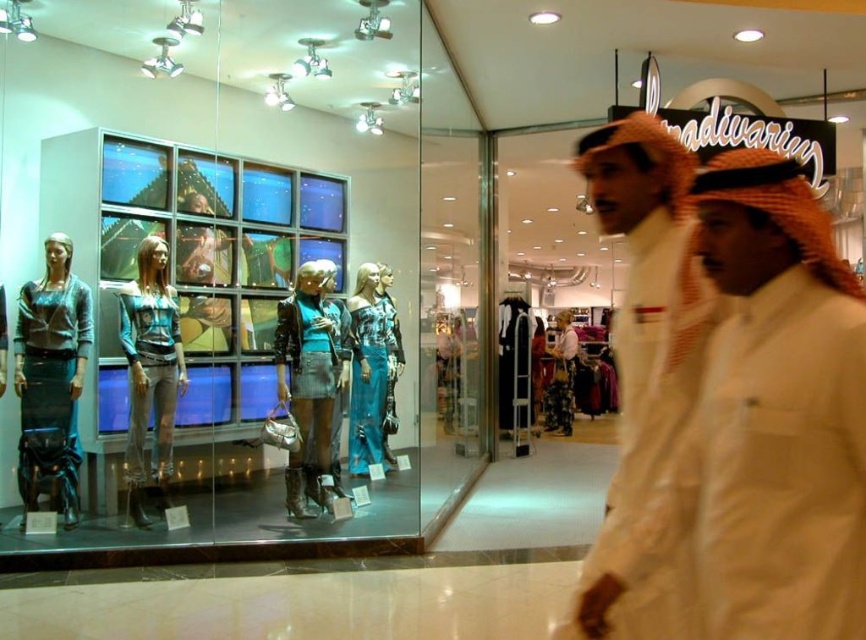
Question: Which object is positioned closest to the floral fabric dress at center?

Choices:
 (A) matte teal fabric dress at center
 (B) white cotton headscarf at center

Answer: (A)

Question: Is white cotton headscarf at center to the left of floral fabric dress at center from the viewer's perspective?

Choices:
 (A) yes
 (B) no

Answer: (A)

Question: Which object appears closest to the camera in this image?

Choices:
 (A) matte teal fabric dress at center
 (B) floral fabric dress at center
 (C) metallic blue dress at left
 (D) blue satin dress at center

Answer: (C)

Question: Can you confirm if white cotton headscarf at center is bigger than matte teal fabric dress at center?

Choices:
 (A) yes
 (B) no

Answer: (A)

Question: Estimate the real-world distances between objects in this image. Which object is farther from the metallic blue dress at left?

Choices:
 (A) matte teal fabric dress at center
 (B) blue satin dress at center
 (C) floral fabric dress at center

Answer: (C)

Question: In this image, where is blue satin dress at center located relative to floral fabric dress at center?

Choices:
 (A) below
 (B) above

Answer: (B)